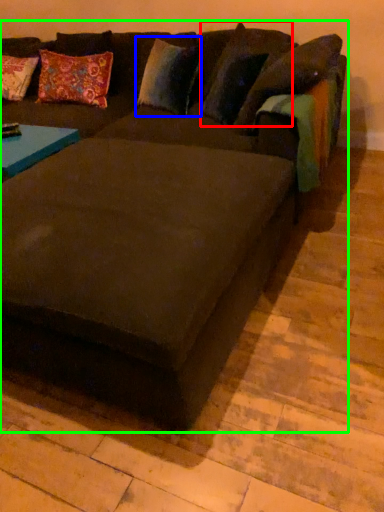
Question: Which object is the farthest from pillow (highlighted by a red box)? Choose among these: pillow (highlighted by a blue box) or studio couch (highlighted by a green box).

Choices:
 (A) pillow
 (B) studio couch

Answer: (B)